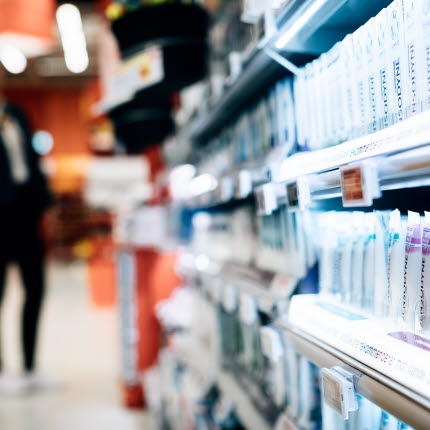
Where is `orange wall`? This screenshot has height=430, width=430. orange wall is located at coordinates (158, 280).